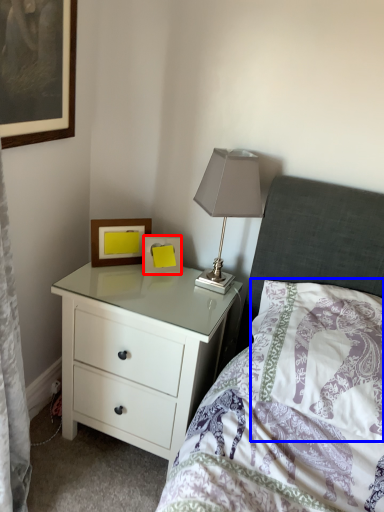
Question: Among these objects, which one is farthest to the camera, picture frame (highlighted by a red box) or pillow (highlighted by a blue box)?

Choices:
 (A) picture frame
 (B) pillow

Answer: (A)